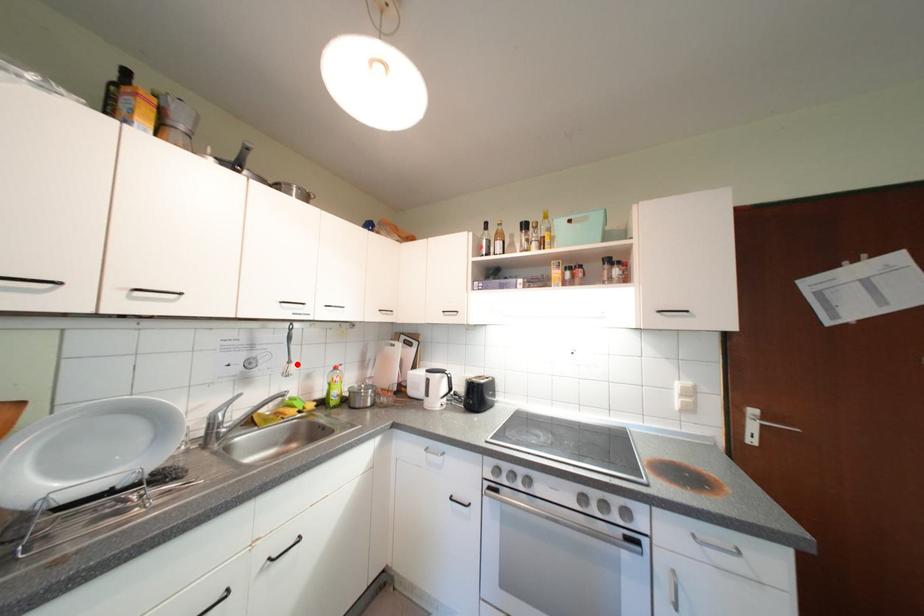
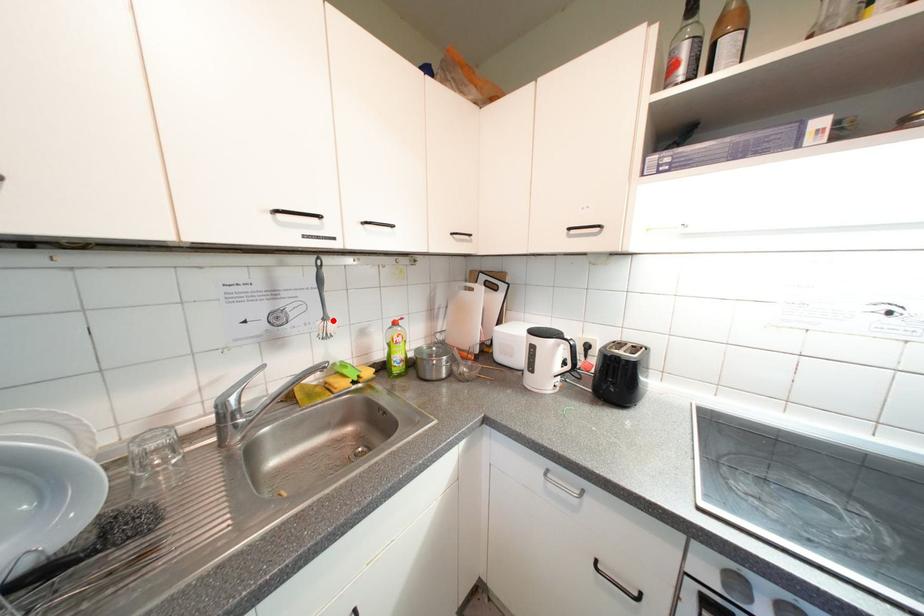
I am providing you with two images of the same scene from different viewpoints. A red point is marked on the first image and another point is marked on the second image. Is the marked point in image1 the same physical position as the marked point in image2?

Yes